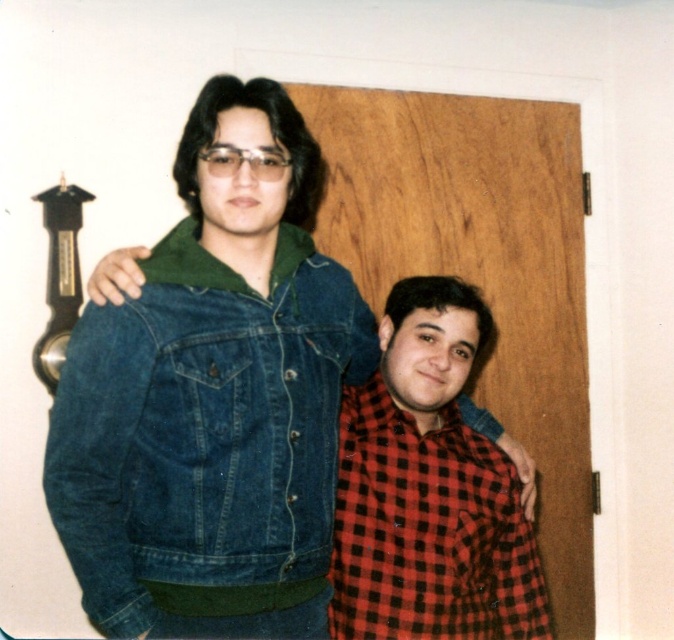
Is denim jacket at upper left positioned before red checkered shirt at lower right?

Yes, it is.

How much distance is there between denim jacket at upper left and red checkered shirt at lower right?

denim jacket at upper left is 12.05 inches from red checkered shirt at lower right.

Who is more forward, (299, 298) or (410, 609)?

Point (299, 298) is in front.

Locate an element on the screen. The image size is (674, 640). denim jacket at upper left is located at coordinates (214, 396).